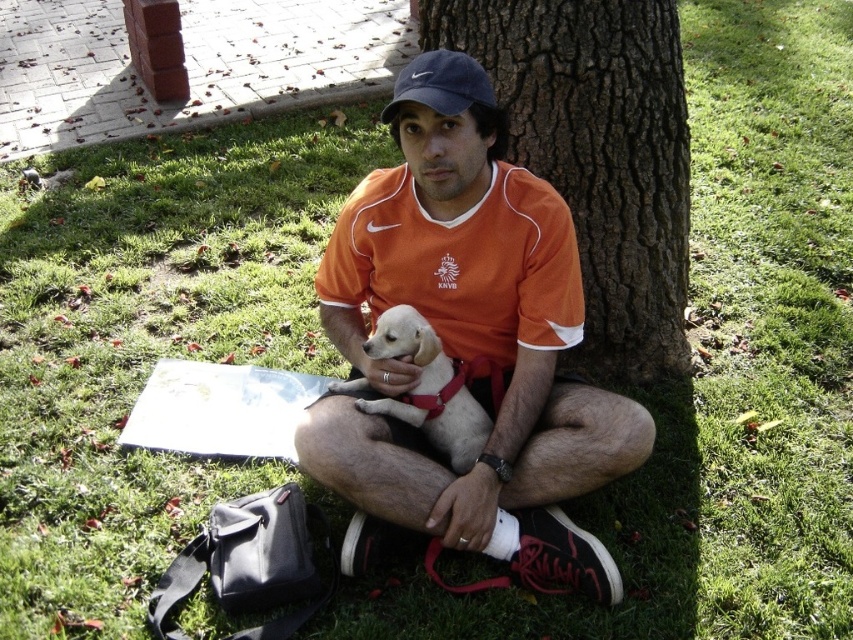
Question: Can you confirm if brown rough bark tree at center is bigger than matte blue baseball cap at upper center?

Choices:
 (A) no
 (B) yes

Answer: (B)

Question: Does white fur dog at center have a larger size compared to matte blue baseball cap at upper center?

Choices:
 (A) yes
 (B) no

Answer: (B)

Question: Is orange jersey at center above brown rough bark tree at center?

Choices:
 (A) yes
 (B) no

Answer: (B)

Question: Which object is positioned closest to the white fur dog at center?

Choices:
 (A) brown rough bark tree at center
 (B) matte blue baseball cap at upper center

Answer: (B)

Question: Which object is positioned closest to the orange jersey at center?

Choices:
 (A) matte blue baseball cap at upper center
 (B) brown rough bark tree at center

Answer: (A)

Question: Based on their relative distances, which object is nearer to the matte blue baseball cap at upper center?

Choices:
 (A) white fur dog at center
 (B) brown rough bark tree at center
 (C) orange jersey at center

Answer: (C)